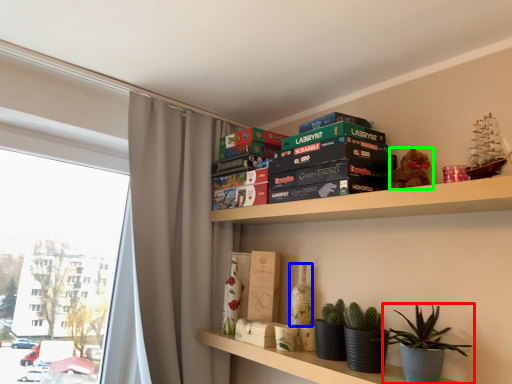
Question: Estimate the real-world distances between objects in this image. Which object is closer to houseplant (highlighted by a red box), bottle (highlighted by a blue box) or toy (highlighted by a green box)?

Choices:
 (A) bottle
 (B) toy

Answer: (B)